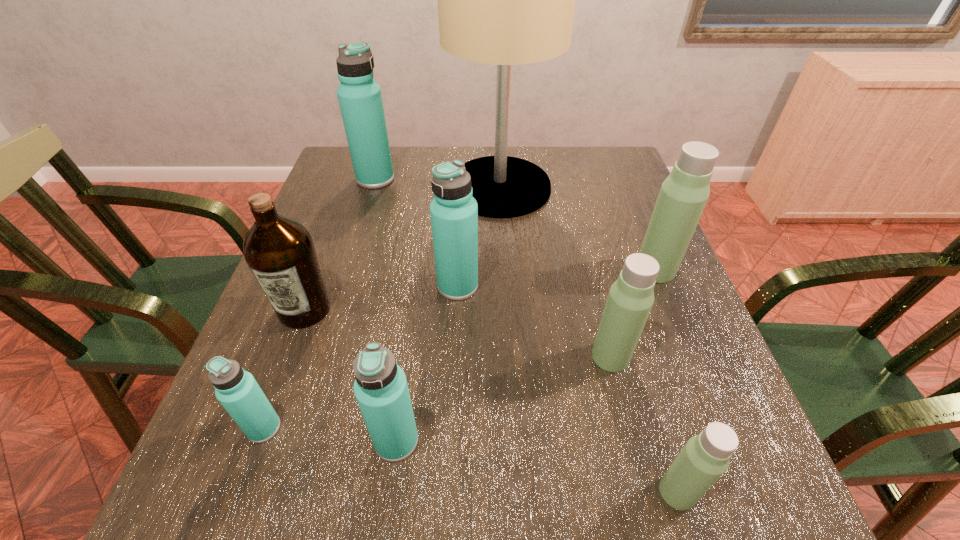
Find the location of a particular element. vacant point located 0.310m on the label of the olive oil is located at coordinates (234, 498).

Locate an element on the screen. The height and width of the screenshot is (540, 960). vacant space located 0.180m on the back of the fourth object from left to right is located at coordinates (411, 335).

At what (x,y) coordinates should I click in order to perform the action: click on vacant space located on the back of the second nearest light thermos bottle. Please return your answer as a coordinate pair (x, y). Looking at the image, I should click on point(577,221).

The image size is (960, 540). Find the location of `vacant space located on the front of the smallest aqua thermos bottle`. vacant space located on the front of the smallest aqua thermos bottle is located at coordinates (231, 518).

The height and width of the screenshot is (540, 960). Find the location of `vacant area situated on the left of the nearest light thermos bottle`. vacant area situated on the left of the nearest light thermos bottle is located at coordinates (439, 492).

The image size is (960, 540). I want to click on table lamp situated at the far edge, so click(506, 0).

Locate an element on the screen. This screenshot has height=540, width=960. thermos bottle positioned at the far edge is located at coordinates pos(360,100).

At what (x,y) coordinates should I click in order to perform the action: click on object that is at the near edge. Please return your answer as a coordinate pair (x, y). The width and height of the screenshot is (960, 540). Looking at the image, I should click on (705, 457).

In order to click on olive oil that is at the left edge in this screenshot , I will do `click(280, 252)`.

Locate an element on the screen. Image resolution: width=960 pixels, height=540 pixels. object at the far left corner is located at coordinates (360, 100).